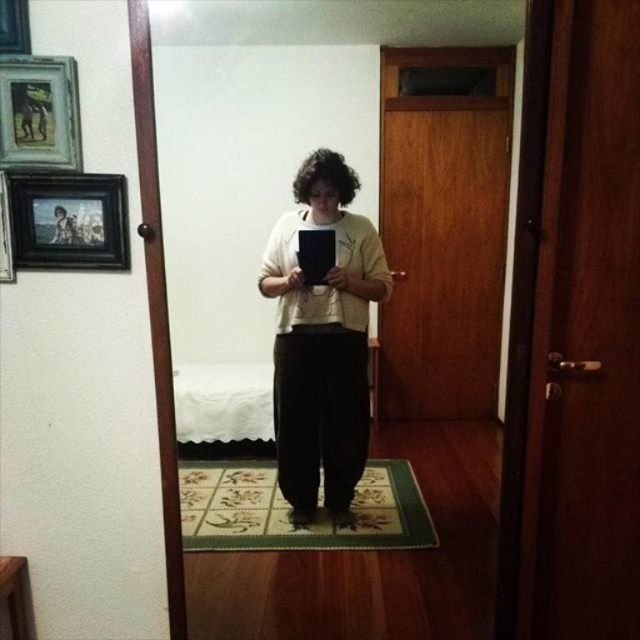
Between matte beige sweater at center and black matte picture frame at upper left, which one is positioned lower?

Positioned lower is matte beige sweater at center.

Can you confirm if matte beige sweater at center is shorter than black matte picture frame at upper left?

Incorrect, matte beige sweater at center's height does not fall short of black matte picture frame at upper left's.

Which is behind, point (280, 372) or point (8, 205)?

Positioned behind is point (280, 372).

You are a GUI agent. You are given a task and a screenshot of the screen. Output one action in this format:
    pyautogui.click(x=<x>, y=<y>)
    Task: Click on the matte beige sweater at center
    This screenshot has height=640, width=640.
    Given the screenshot: What is the action you would take?
    pyautogui.click(x=323, y=340)

Find the location of a particular element. black glossy picture frame at upper left is located at coordinates (68, 220).

Is point (36, 230) closer to viewer compared to point (35, 150)?

No, (36, 230) is further to viewer.

Find the location of `black glossy picture frame at upper left`. black glossy picture frame at upper left is located at coordinates (68, 220).

Looking at this image, between wooden framed picture at upper left and black matte picture frame at upper left, which one has less height?

Standing shorter between the two is wooden framed picture at upper left.

Which is above, wooden framed picture at upper left or black matte picture frame at upper left?

wooden framed picture at upper left is above.

Is point (26, 67) positioned after point (3, 282)?

No, it is in front of (3, 282).

Identify the location of wooden framed picture at upper left. (38, 113).